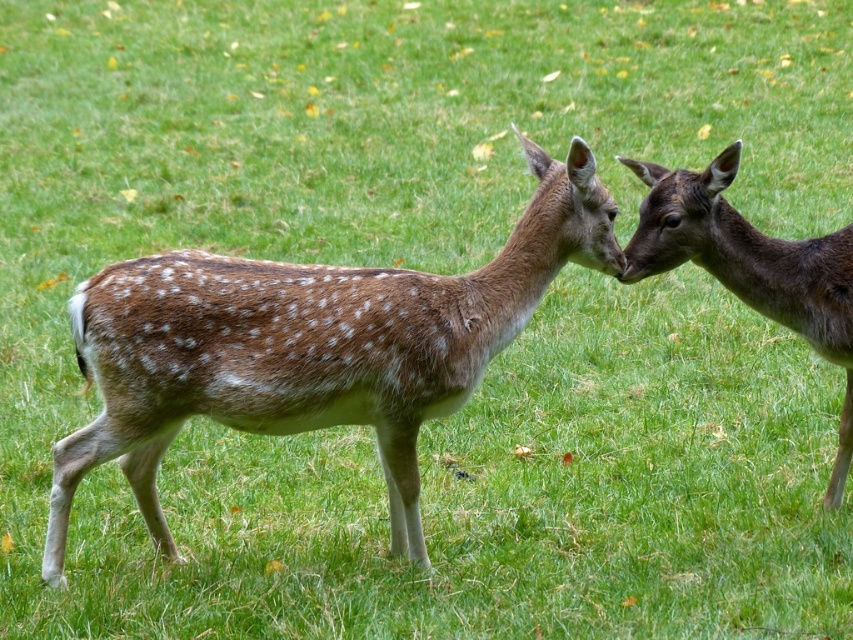
Who is taller, brown speckled fur at center or brown speckled fur at right?

brown speckled fur at center is taller.

Is brown speckled fur at center further to the viewer compared to brown speckled fur at right?

Yes.

Measure the distance between point (x=148, y=454) and camera.

Point (x=148, y=454) is 11.58 feet away from camera.

Identify the location of brown speckled fur at center. (310, 346).